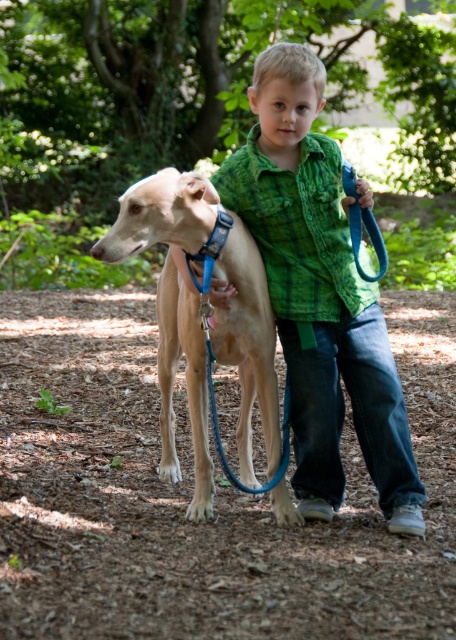
Question: Which of the following is the closest to the observer?

Choices:
 (A) green plaid shirt at center
 (B) light brown fur at center

Answer: (B)

Question: Among these objects, which one is nearest to the camera?

Choices:
 (A) light brown fur at center
 (B) green plaid shirt at center

Answer: (A)

Question: Which point is closer to the camera?

Choices:
 (A) (294, 189)
 (B) (202, 356)

Answer: (A)

Question: Is green plaid shirt at center above light brown fur at center?

Choices:
 (A) no
 (B) yes

Answer: (B)

Question: Does green plaid shirt at center have a smaller size compared to light brown fur at center?

Choices:
 (A) yes
 (B) no

Answer: (A)

Question: Is the position of green plaid shirt at center more distant than that of light brown fur at center?

Choices:
 (A) no
 (B) yes

Answer: (B)